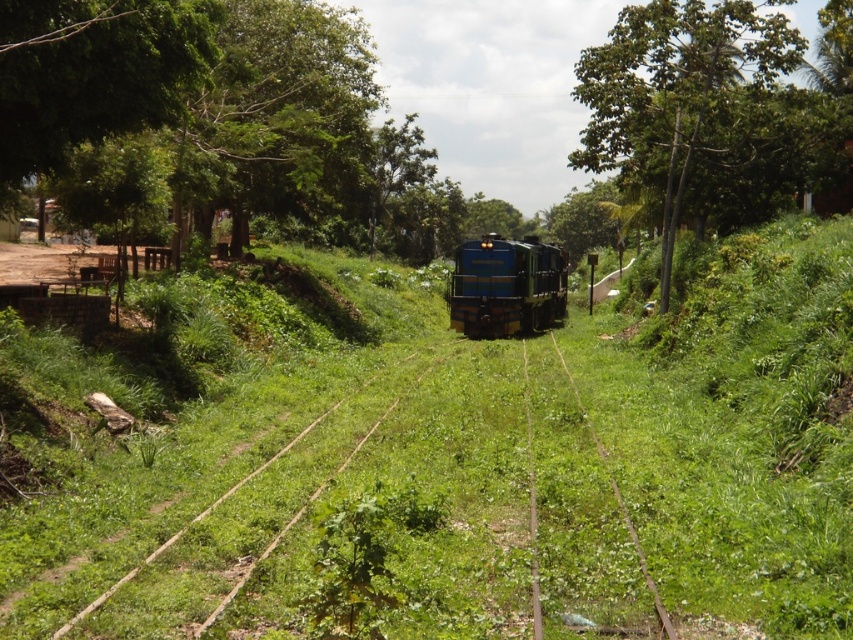
Between green leafy tree at upper center and blue glossy train at center, which one appears on the right side from the viewer's perspective?

green leafy tree at upper center

Measure the distance from green leafy tree at upper center to blue glossy train at center.

green leafy tree at upper center and blue glossy train at center are 11.58 meters apart.

Image resolution: width=853 pixels, height=640 pixels. What are the coordinates of `green leafy tree at upper center` in the screenshot? It's located at (674, 88).